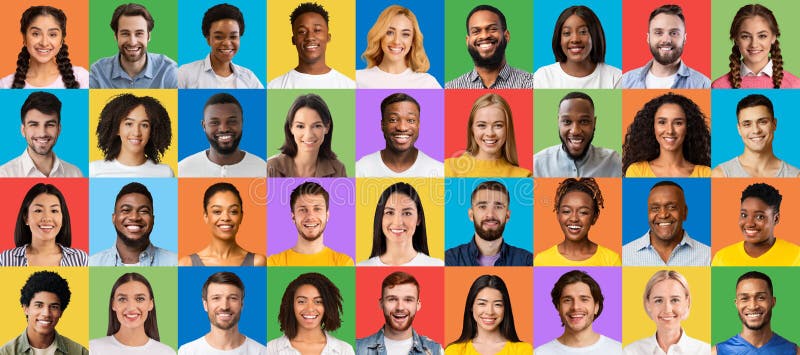
Where is `pictures in top row`? This screenshot has width=800, height=355. pictures in top row is located at coordinates (41, 22), (128, 41), (217, 40), (309, 46), (397, 44), (500, 44), (577, 46), (653, 42), (757, 41).